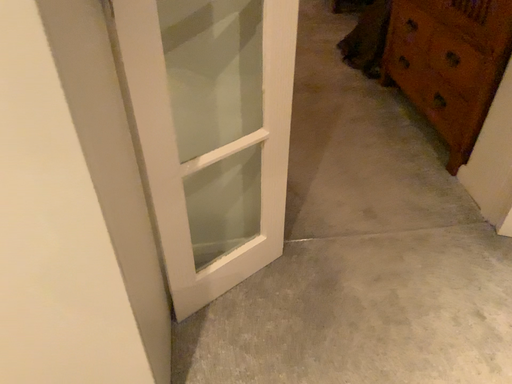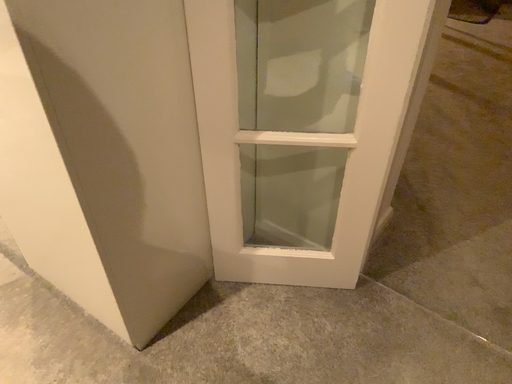
Question: Which way did the camera rotate in the video?

Choices:
 (A) rotated upward
 (B) rotated downward

Answer: (A)